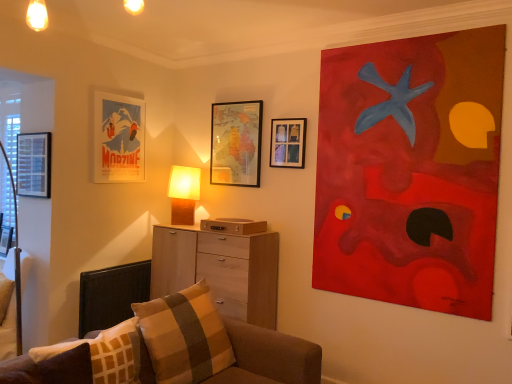
Question: Should I look upward or downward to see acrylic painting at upper right, the sixth picture frame in the left-to-right sequence?

Choices:
 (A) up
 (B) down

Answer: (A)

Question: From a real-world perspective, is light wood chest of drawers at center positioned over matte wooden table lamp at center based on gravity?

Choices:
 (A) yes
 (B) no

Answer: (B)

Question: Considering the relative sizes of light wood chest of drawers at center and matte wooden table lamp at center in the image provided, is light wood chest of drawers at center bigger than matte wooden table lamp at center?

Choices:
 (A) yes
 (B) no

Answer: (A)

Question: Is light wood chest of drawers at center further to camera compared to matte wooden table lamp at center?

Choices:
 (A) no
 (B) yes

Answer: (A)

Question: Is light wood chest of drawers at center looking in the opposite direction of matte wooden table lamp at center?

Choices:
 (A) yes
 (B) no

Answer: (B)

Question: Is light wood chest of drawers at center not close to matte wooden table lamp at center?

Choices:
 (A) no
 (B) yes

Answer: (A)

Question: Considering the relative positions of light wood chest of drawers at center and matte wooden table lamp at center in the image provided, is light wood chest of drawers at center to the left of matte wooden table lamp at center from the viewer's perspective?

Choices:
 (A) yes
 (B) no

Answer: (B)

Question: From the image's perspective, is black fabric swivel chair at lower left located beneath matte wooden picture frame at upper center, acting as the 5th picture frame starting from the left?

Choices:
 (A) no
 (B) yes

Answer: (B)

Question: Does black fabric swivel chair at lower left appear on the left side of matte wooden picture frame at upper center, the 2th picture frame in the right-to-left sequence?

Choices:
 (A) yes
 (B) no

Answer: (A)

Question: Does black fabric swivel chair at lower left have a smaller size compared to matte wooden picture frame at upper center, acting as the 5th picture frame starting from the left?

Choices:
 (A) no
 (B) yes

Answer: (A)

Question: Is black fabric swivel chair at lower left facing towards matte wooden picture frame at upper center, the 2th picture frame in the right-to-left sequence?

Choices:
 (A) no
 (B) yes

Answer: (A)

Question: Is black fabric swivel chair at lower left thinner than matte wooden picture frame at upper center, the 2th picture frame in the right-to-left sequence?

Choices:
 (A) no
 (B) yes

Answer: (A)

Question: Is the depth of black fabric swivel chair at lower left greater than that of matte wooden picture frame at upper center, the 2th picture frame in the right-to-left sequence?

Choices:
 (A) no
 (B) yes

Answer: (A)

Question: Considering the relative sizes of matte wooden picture frame at upper center, the 2th picture frame in the right-to-left sequence, and brown plaid pillow at lower left, which is the second pillow from back to front, in the image provided, is matte wooden picture frame at upper center, the 2th picture frame in the right-to-left sequence, taller than brown plaid pillow at lower left, which is the second pillow from back to front,?

Choices:
 (A) no
 (B) yes

Answer: (B)